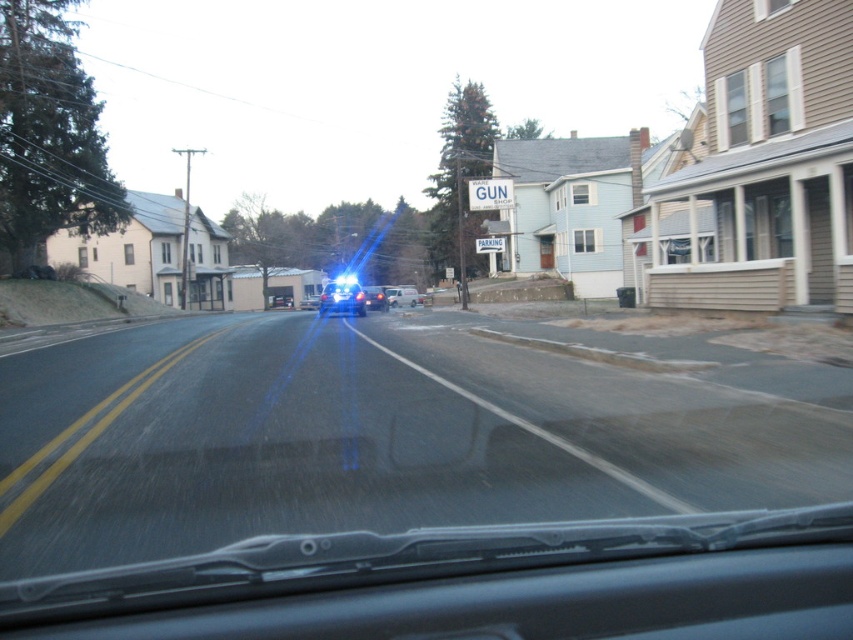
Which is in front, point (341, 304) or point (381, 294)?

Point (341, 304) is more forward.

Can you confirm if glossy plastic car at center is shorter than glossy blue car at center?

Incorrect, glossy plastic car at center's height does not fall short of glossy blue car at center's.

Where is `glossy plastic car at center`? The width and height of the screenshot is (853, 640). glossy plastic car at center is located at coordinates (341, 298).

Image resolution: width=853 pixels, height=640 pixels. I want to click on transparent glass windshield at center, so click(x=405, y=490).

Is point (654, 497) positioned behind point (399, 296)?

No, (654, 497) is in front of (399, 296).

Locate an element on the screen. Image resolution: width=853 pixels, height=640 pixels. transparent glass windshield at center is located at coordinates (405, 490).

Is transparent glass windshield at center taller than glossy blue car at center?

No, transparent glass windshield at center is not taller than glossy blue car at center.

Where is `transparent glass windshield at center`? This screenshot has height=640, width=853. transparent glass windshield at center is located at coordinates (405, 490).

Who is more distant from viewer, (x=566, y=541) or (x=375, y=304)?

Point (x=375, y=304)

Identify the location of transparent glass windshield at center. The height and width of the screenshot is (640, 853). (405, 490).